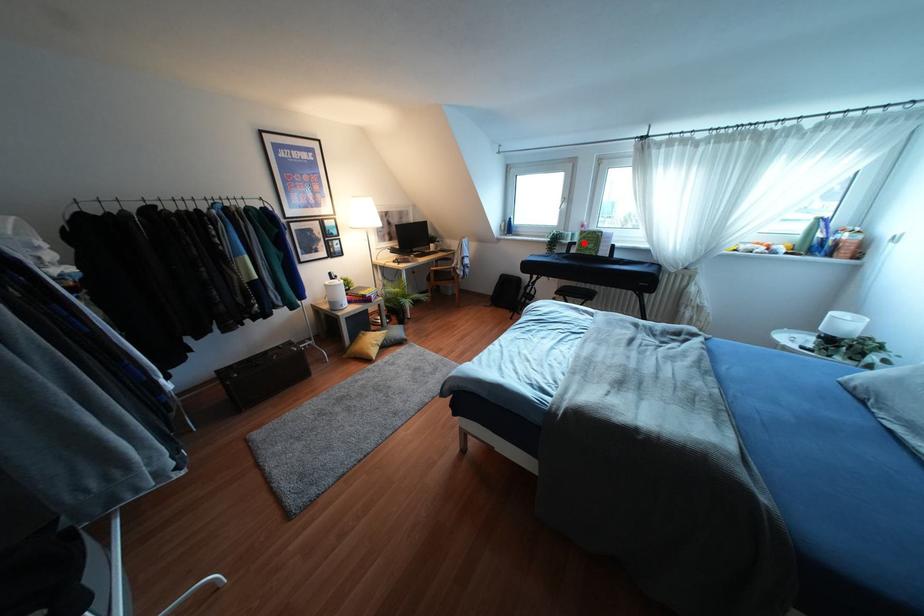
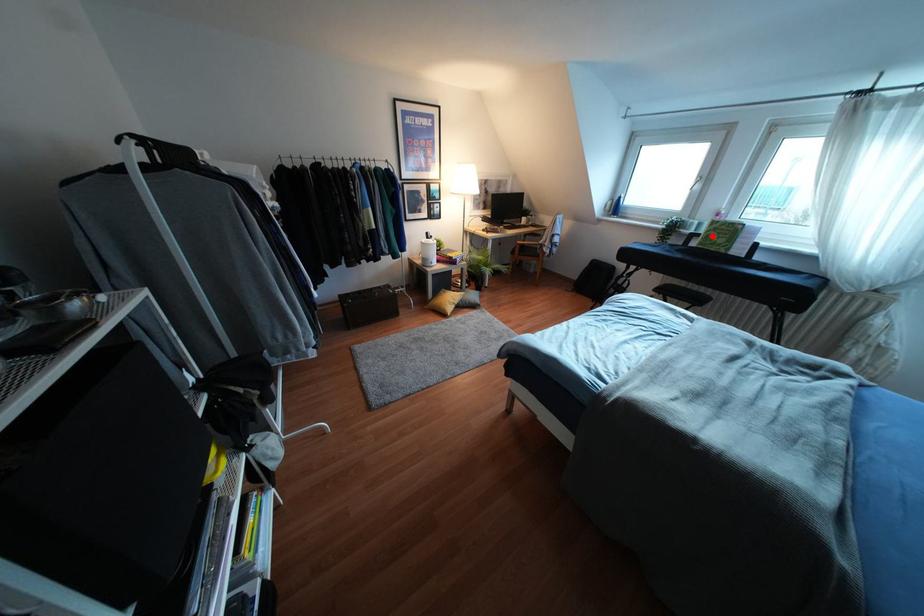
I am providing you with two images of the same scene from different viewpoints. A red point is marked on the first image and another point is marked on the second image. Is the marked point in image1 the same physical position as the marked point in image2?

Yes